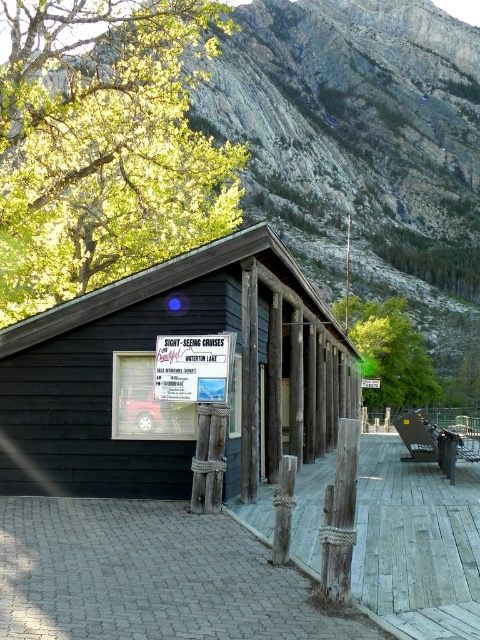
Is green leafy tree at upper left bigger than white paper sign at center?

Indeed, green leafy tree at upper left has a larger size compared to white paper sign at center.

Based on the photo, is green leafy tree at upper left thinner than white paper sign at center?

No.

Locate an element on the screen. The height and width of the screenshot is (640, 480). green leafy tree at upper left is located at coordinates (105, 145).

Find the location of a particular element. This screenshot has height=640, width=480. green leafy tree at upper left is located at coordinates (105, 145).

Can you confirm if rugged stone mountain at upper center is taller than green leafy tree at upper left?

Yes, rugged stone mountain at upper center is taller than green leafy tree at upper left.

Does rugged stone mountain at upper center have a smaller size compared to green leafy tree at upper left?

No, rugged stone mountain at upper center is not smaller than green leafy tree at upper left.

Does point (350, 16) lie in front of point (147, 129)?

That is False.

In order to click on rugged stone mountain at upper center in this screenshot , I will do `click(361, 148)`.

Does rugged stone mountain at upper center lie in front of weathered wood dock at lower center?

No, it is behind weathered wood dock at lower center.

Is rugged stone mountain at upper center thinner than weathered wood dock at lower center?

No.

Is point (414, 115) closer to camera compared to point (468, 481)?

No, it is not.

Find the location of a particular element. rugged stone mountain at upper center is located at coordinates (361, 148).